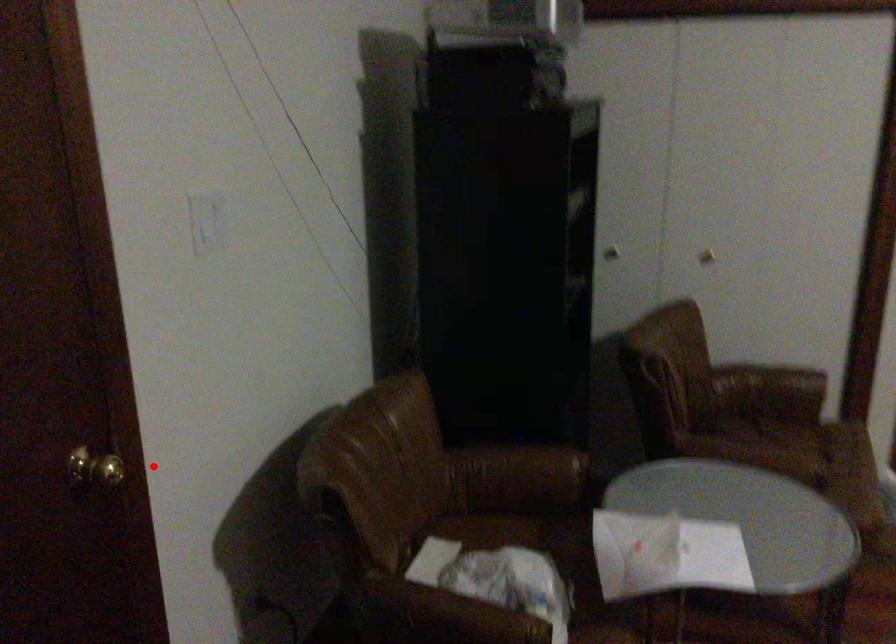
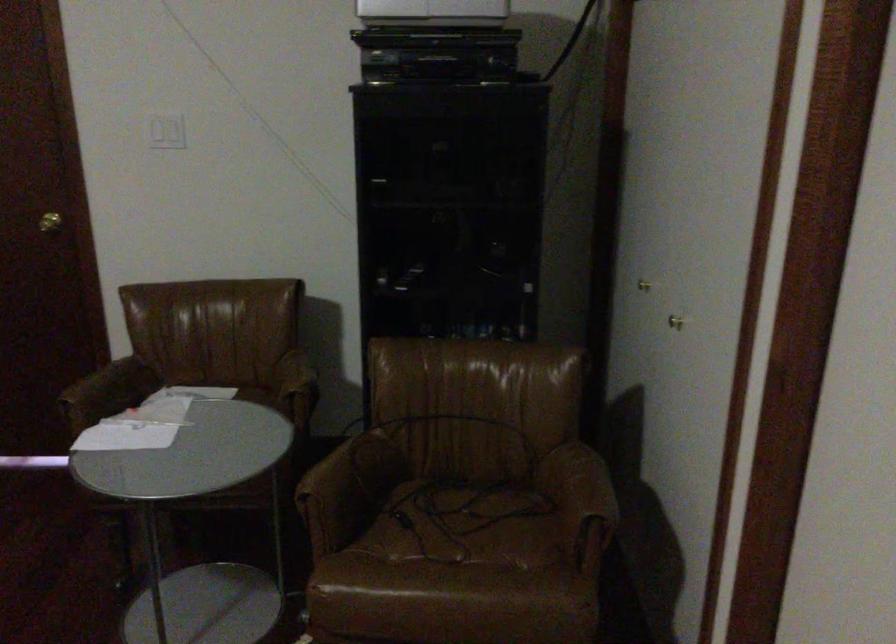
In the second image, find the point that corresponds to the highlighted location in the first image.

(49, 222)